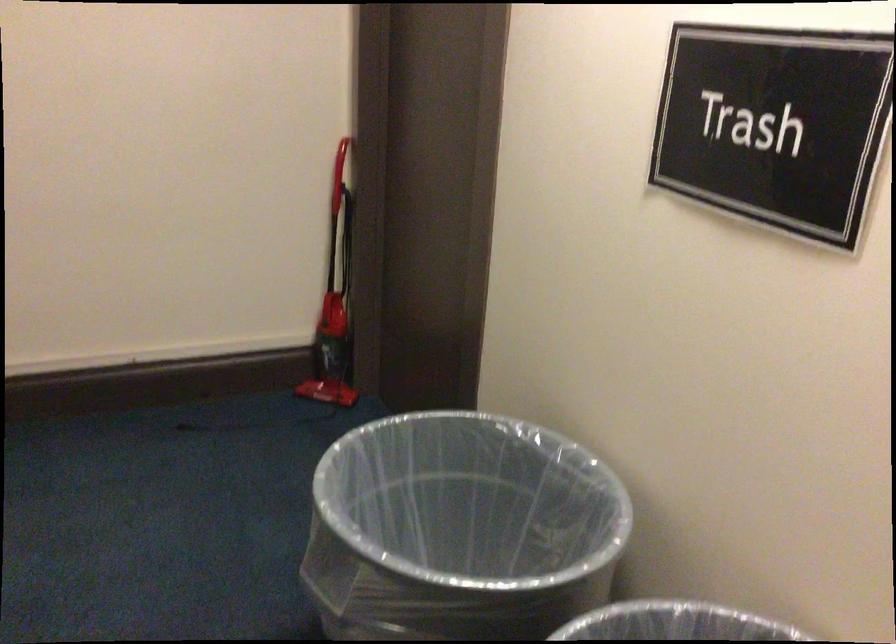
Find where to grasp the red vacuum handle. Please return your answer as a coordinate pair (x, y).

(324, 153)